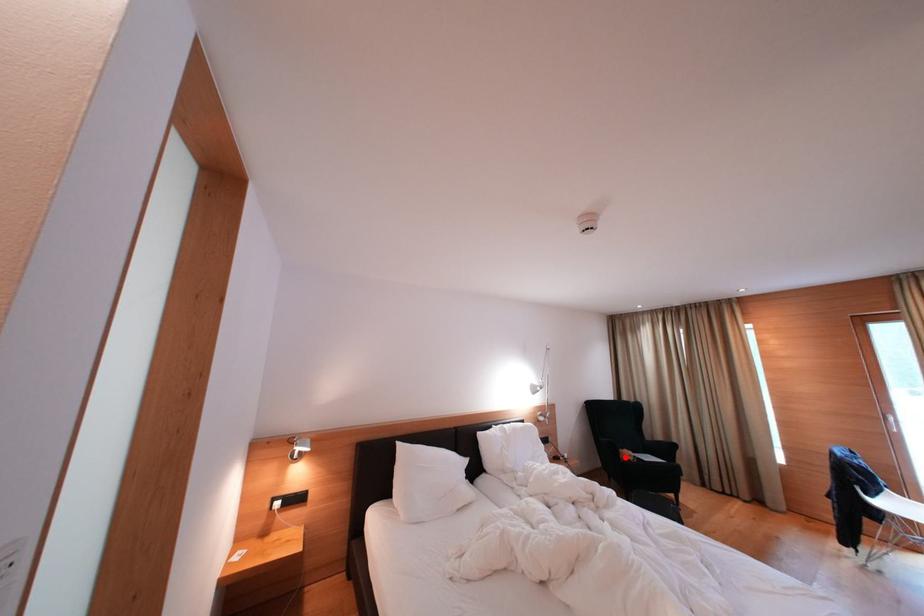
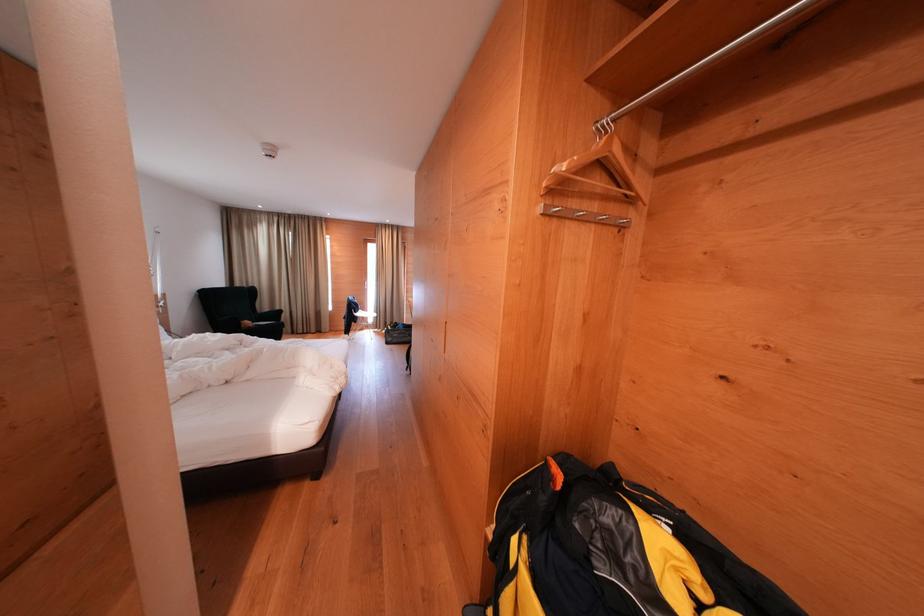
Question: I am providing you with two images of the same scene from different viewpoints. Given a red point in image1, look at the same physical point in image2. Is it:

Choices:
 (A) Closer to the viewpoint
 (B) Farther from the viewpoint

Answer: (B)